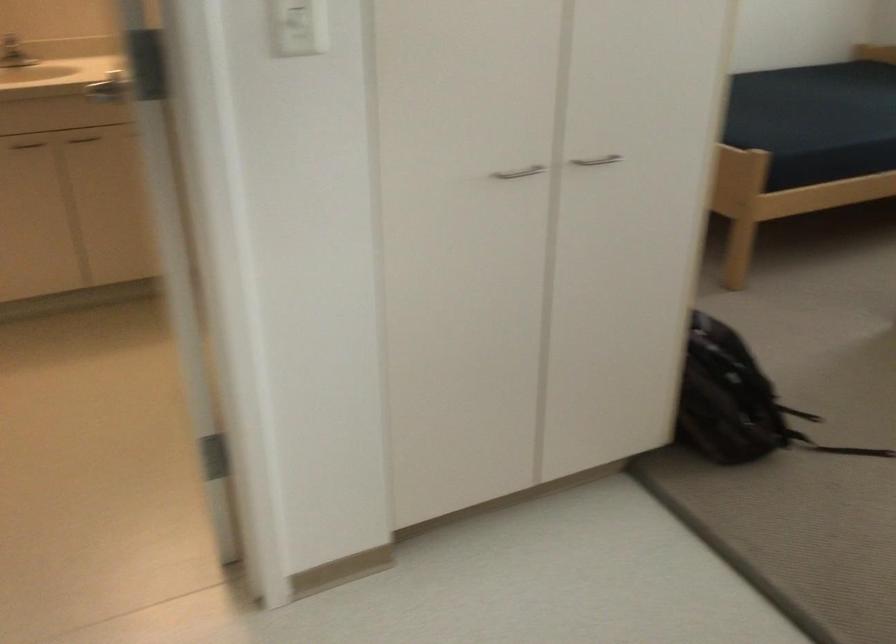
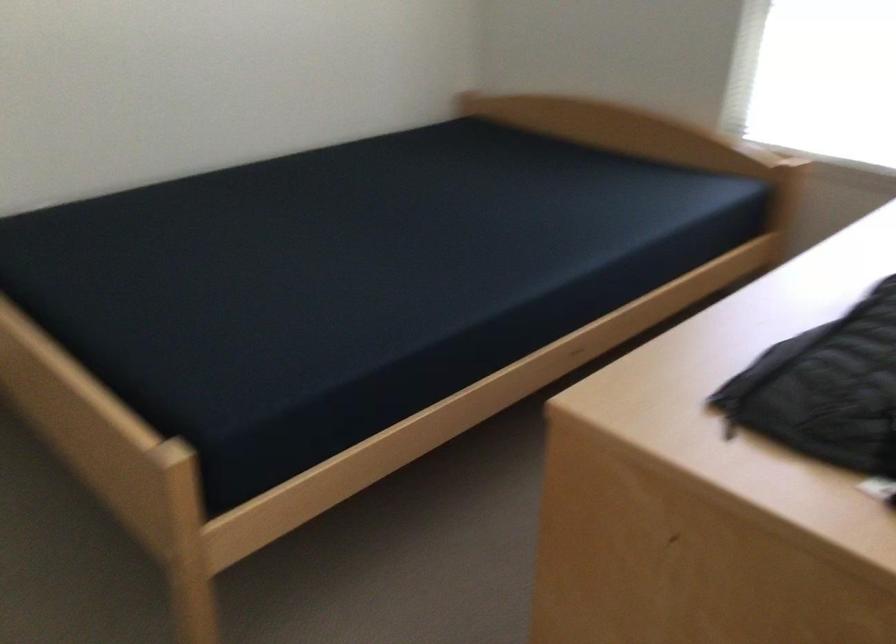
Where in the second image is the point corresponding to the point at 788,93 from the first image?

(362, 256)